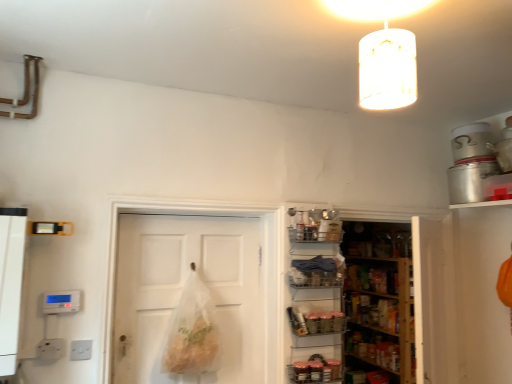
Question: Which direction should I rotate to look at metallic wire basket at center, arranged as the first shelf when viewed from the top, — up or down?

Choices:
 (A) down
 (B) up

Answer: (A)

Question: From a real-world perspective, is translucent white cylinder at upper center positioned over metallic wire basket at center, the second shelf in the bottom-to-top sequence, based on gravity?

Choices:
 (A) yes
 (B) no

Answer: (A)

Question: Can you confirm if translucent white cylinder at upper center is wider than metallic wire basket at center, arranged as the first shelf when viewed from the top?

Choices:
 (A) no
 (B) yes

Answer: (B)

Question: Does translucent white cylinder at upper center appear on the left side of metallic wire basket at center, the second shelf in the bottom-to-top sequence?

Choices:
 (A) yes
 (B) no

Answer: (B)

Question: Is translucent white cylinder at upper center to the right of metallic wire basket at center, arranged as the first shelf when viewed from the top, from the viewer's perspective?

Choices:
 (A) no
 (B) yes

Answer: (B)

Question: Does translucent white cylinder at upper center have a larger size compared to metallic wire basket at center, the second shelf in the bottom-to-top sequence?

Choices:
 (A) yes
 (B) no

Answer: (A)

Question: Considering the relative sizes of translucent white cylinder at upper center and metallic wire basket at center, the second shelf in the bottom-to-top sequence, in the image provided, is translucent white cylinder at upper center smaller than metallic wire basket at center, the second shelf in the bottom-to-top sequence,?

Choices:
 (A) yes
 (B) no

Answer: (B)

Question: Does wooden shelves at center lie behind metallic wire basket at center, positioned as the first shelf in bottom-to-top order?

Choices:
 (A) no
 (B) yes

Answer: (B)

Question: Could you tell me if wooden shelves at center is turned towards metallic wire basket at center, positioned as the first shelf in bottom-to-top order?

Choices:
 (A) yes
 (B) no

Answer: (B)

Question: From a real-world perspective, is wooden shelves at center beneath metallic wire basket at center, positioned as the first shelf in bottom-to-top order?

Choices:
 (A) no
 (B) yes

Answer: (A)

Question: Is the position of wooden shelves at center less distant than that of metallic wire basket at center, positioned as the first shelf in bottom-to-top order?

Choices:
 (A) yes
 (B) no

Answer: (B)

Question: Is wooden shelves at center touching metallic wire basket at center, positioned as the first shelf in bottom-to-top order?

Choices:
 (A) yes
 (B) no

Answer: (B)

Question: Is wooden shelves at center not close to metallic wire basket at center, positioned as the first shelf in bottom-to-top order?

Choices:
 (A) yes
 (B) no

Answer: (B)

Question: Is metallic wire basket at center, the second shelf in the bottom-to-top sequence, inside white matte door at center?

Choices:
 (A) yes
 (B) no

Answer: (B)